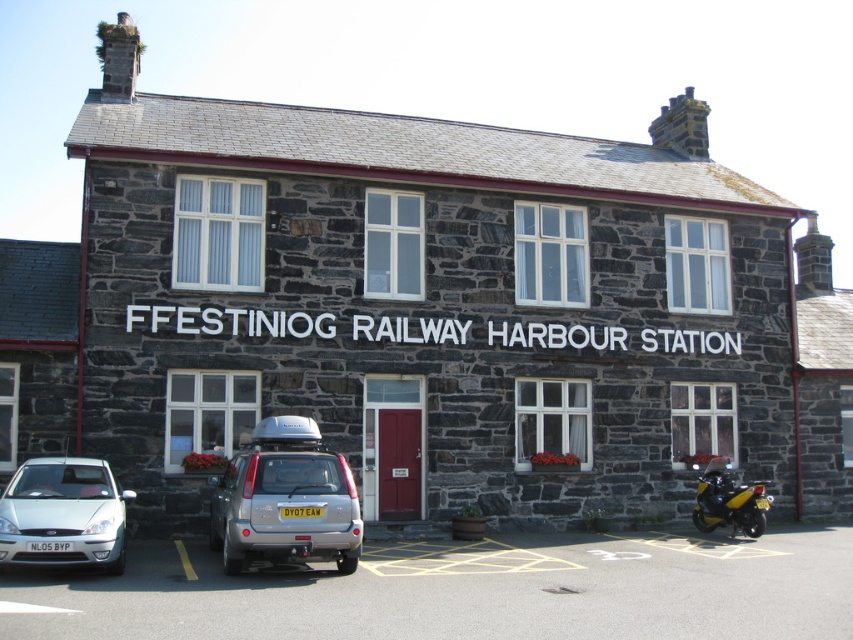
Which is above, silver metallic car at lower left or white plastic license plate at center?

silver metallic car at lower left

Does silver metallic car at lower left appear on the right side of white plastic license plate at center?

No, silver metallic car at lower left is not to the right of white plastic license plate at center.

Is point (88, 552) positioned after point (33, 544)?

Yes, it is.

The image size is (853, 640). Identify the location of silver metallic car at lower left. (64, 513).

Between point (289, 506) and point (57, 545), which one is positioned behind?

Positioned behind is point (289, 506).

Consider the image. Does yellow metallic license plate at center have a greater height compared to white plastic license plate at center?

Yes, yellow metallic license plate at center is taller than white plastic license plate at center.

Does point (306, 506) come in front of point (59, 541)?

No.

Locate an element on the screen. This screenshot has width=853, height=640. yellow metallic license plate at center is located at coordinates (300, 509).

Who is positioned more to the right, silver metallic car at lower left or yellow metallic license plate at center?

yellow metallic license plate at center

From the picture: Can you confirm if silver metallic car at lower left is shorter than yellow metallic license plate at center?

In fact, silver metallic car at lower left may be taller than yellow metallic license plate at center.

What do you see at coordinates (64, 513) in the screenshot? The width and height of the screenshot is (853, 640). I see `silver metallic car at lower left` at bounding box center [64, 513].

This screenshot has width=853, height=640. I want to click on silver metallic car at lower left, so click(64, 513).